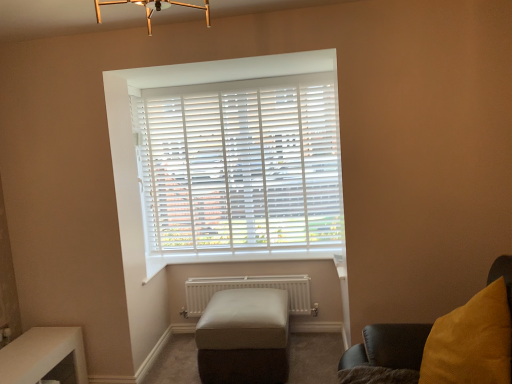
Question: Is white plastic blinds at center looking in the opposite direction of white matte radiator at lower center?

Choices:
 (A) no
 (B) yes

Answer: (A)

Question: Can you confirm if white plastic blinds at center is smaller than white matte radiator at lower center?

Choices:
 (A) yes
 (B) no

Answer: (B)

Question: Considering the relative sizes of white plastic blinds at center and white matte radiator at lower center in the image provided, is white plastic blinds at center thinner than white matte radiator at lower center?

Choices:
 (A) no
 (B) yes

Answer: (B)

Question: Is white plastic blinds at center to the left of white matte radiator at lower center from the viewer's perspective?

Choices:
 (A) no
 (B) yes

Answer: (B)

Question: From a real-world perspective, is white plastic blinds at center over white matte radiator at lower center?

Choices:
 (A) yes
 (B) no

Answer: (A)

Question: Considering the positions of point (181, 175) and point (261, 349), is point (181, 175) closer or farther from the camera than point (261, 349)?

Choices:
 (A) farther
 (B) closer

Answer: (A)

Question: From the image's perspective, is white plastic blinds at center positioned above or below leather ottoman at center?

Choices:
 (A) above
 (B) below

Answer: (A)

Question: Considering their positions, is white plastic blinds at center located in front of or behind leather ottoman at center?

Choices:
 (A) front
 (B) behind

Answer: (B)

Question: From their relative heights in the image, would you say white plastic blinds at center is taller or shorter than leather ottoman at center?

Choices:
 (A) short
 (B) tall

Answer: (B)

Question: From the image's perspective, is leather ottoman at center positioned above or below velvet yellow cushion at right?

Choices:
 (A) below
 (B) above

Answer: (A)

Question: Would you say leather ottoman at center is to the left or to the right of velvet yellow cushion at right in the picture?

Choices:
 (A) left
 (B) right

Answer: (A)

Question: From a real-world perspective, is leather ottoman at center above or below velvet yellow cushion at right?

Choices:
 (A) above
 (B) below

Answer: (B)

Question: Would you say leather ottoman at center is inside or outside velvet yellow cushion at right?

Choices:
 (A) inside
 (B) outside

Answer: (B)

Question: Is velvet yellow cushion at right wider or thinner than leather ottoman at center?

Choices:
 (A) wide
 (B) thin

Answer: (A)

Question: Would you say velvet yellow cushion at right is to the left or to the right of leather ottoman at center in the picture?

Choices:
 (A) right
 (B) left

Answer: (A)